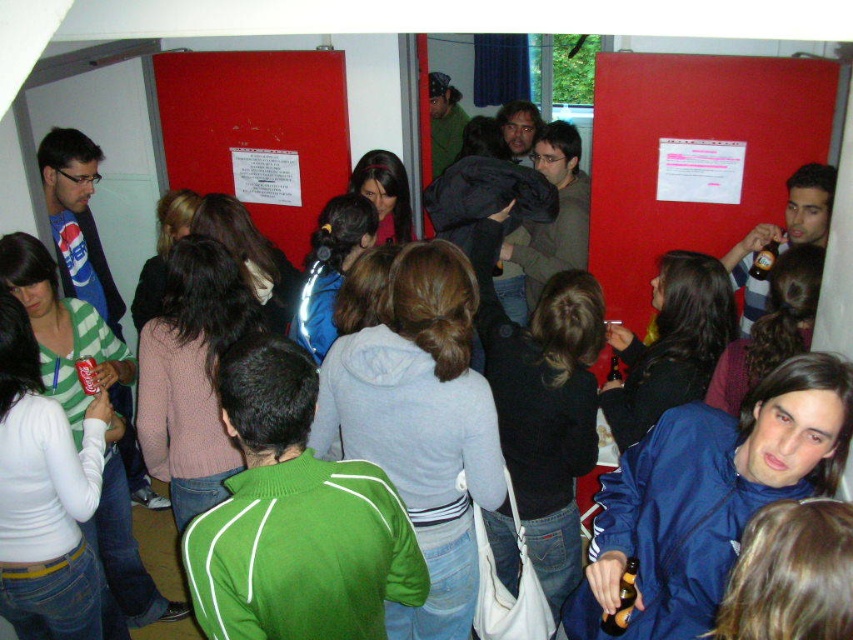
You are at a party in the hallway and want to hand a note to someone. You have a blue fabric jacket at lower right and a white paper at center. Which object is closer to the floor?

The blue fabric jacket at lower right is located below white paper at center, so it is closer to the floor.

You are standing in the hallway and want to take a photo of both point [256,531] and point [251,122] in the image. Since you can only focus on one point at a time, which point should you focus on to ensure both are in the frame?

You should focus on point [251,122] because it is farther from the camera than point [256,531], so focusing on it will keep both points in the frame.